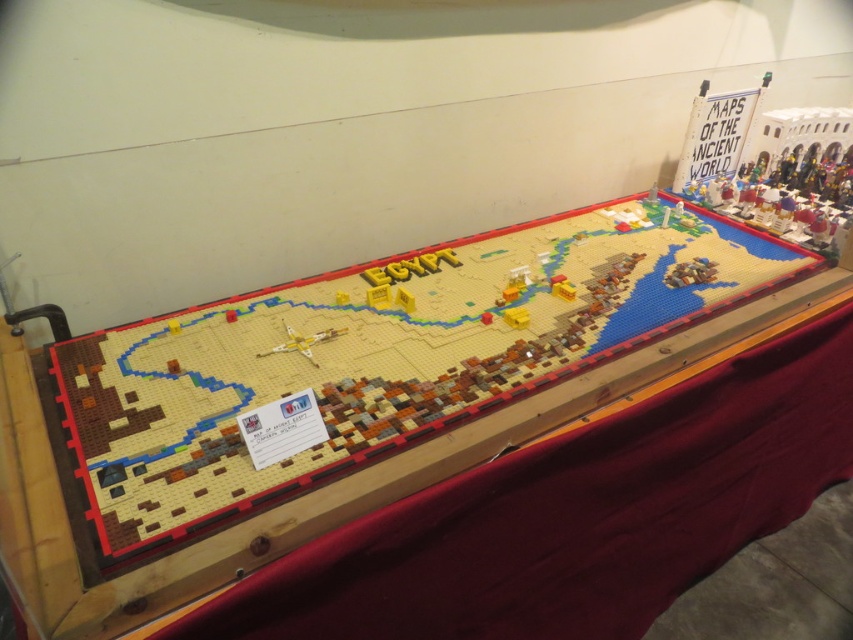
You are a delivery drone operator. You need to place a package on the wooden table at center without hitting the translucent yellow airplane at center. Can you fit the package between them?

The wooden table at center is wider than the translucent yellow airplane at center, so yes, the package can be placed between them as there is enough space.

You are standing in front of the LEGO Egypt model and notice the wooden table at center and the translucent yellow airplane at center. Which object is nearer to you?

The wooden table at center is closer to the viewer than the translucent yellow airplane at center.

You are a visitor at a LEGO exhibition and see the wooden table at center and the translucent yellow airplane at center. Which object is closer to you?

The wooden table at center is above the translucent yellow airplane at center, so the wooden table at center is closer to you.